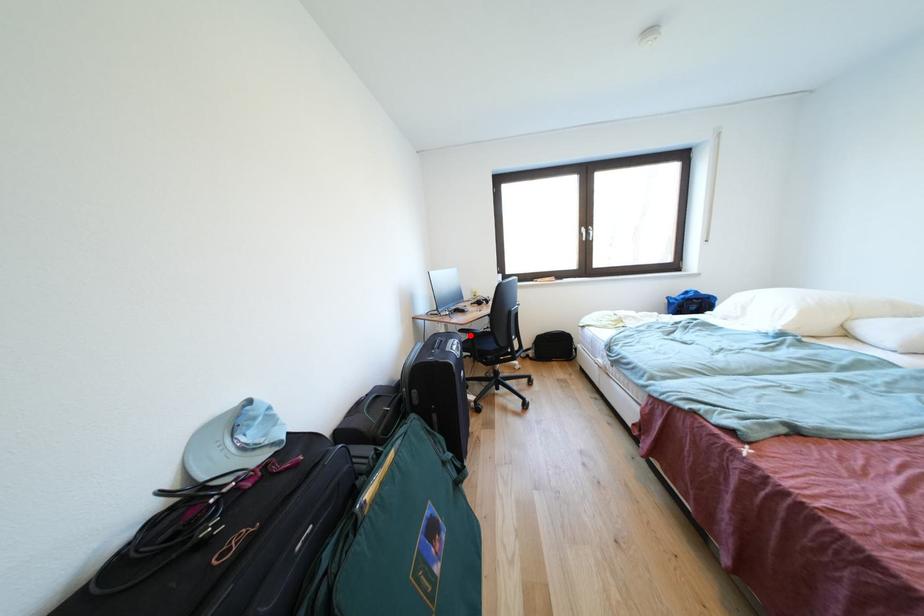
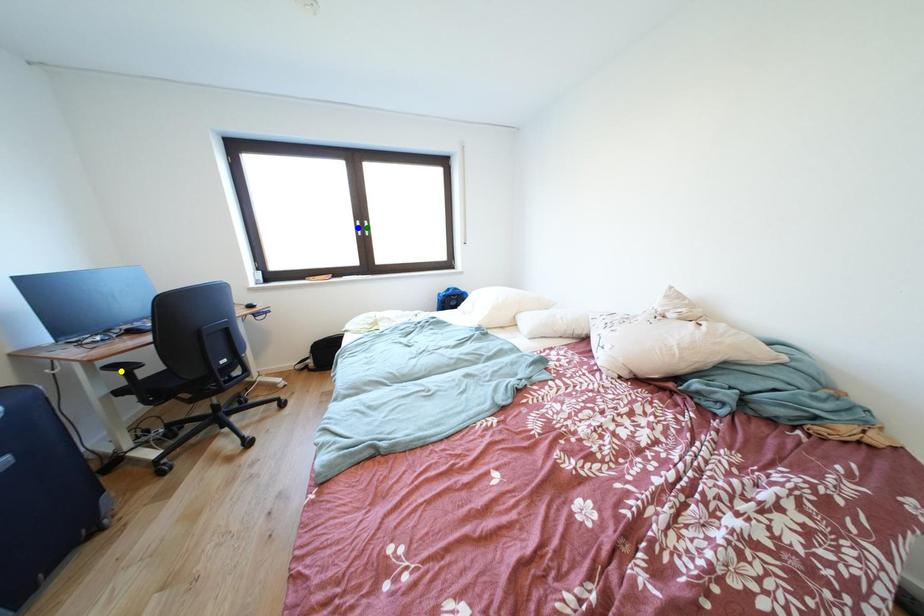
Question: I am providing you with two images of the same scene from different viewpoints. A red point is marked on the first image. You are given multiple points on the second image. Which point in image 2 represents the same 3d spot as the red point in image 1?

Choices:
 (A) yellow point
 (B) green point
 (C) blue point

Answer: (A)